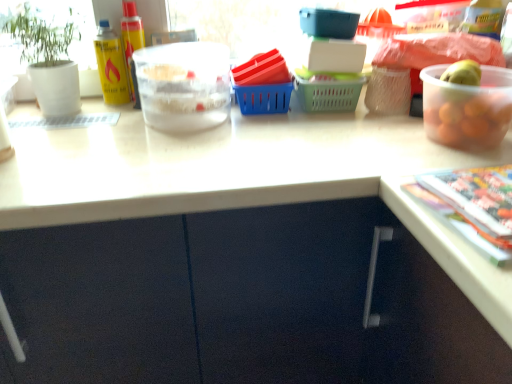
Identify the location of vacant area that is in front of translucent plastic bowl at upper center, positioned as the 2th bowl in front-to-back order. This screenshot has height=384, width=512. (157, 144).